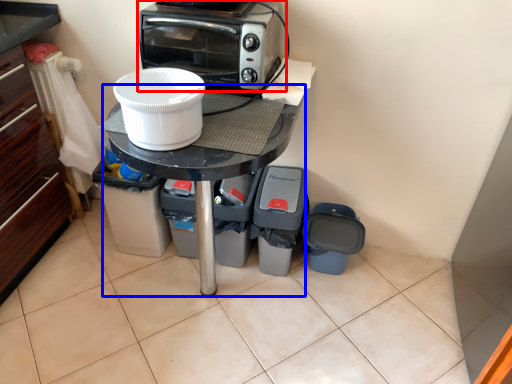
Question: Among these objects, which one is farthest to the camera, kitchen appliance (highlighted by a red box) or table (highlighted by a blue box)?

Choices:
 (A) kitchen appliance
 (B) table

Answer: (A)